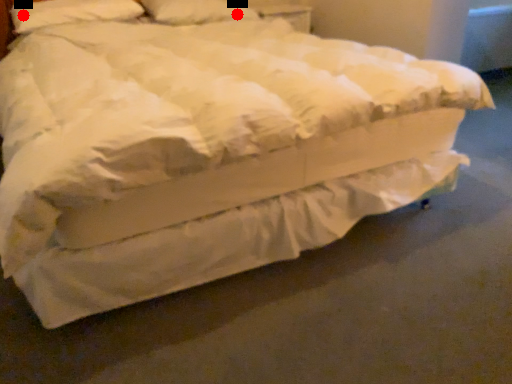
Question: Two points are circled on the image, labeled by A and B beside each circle. Which point appears closest to the camera in this image?

Choices:
 (A) A is closer
 (B) B is closer

Answer: (A)